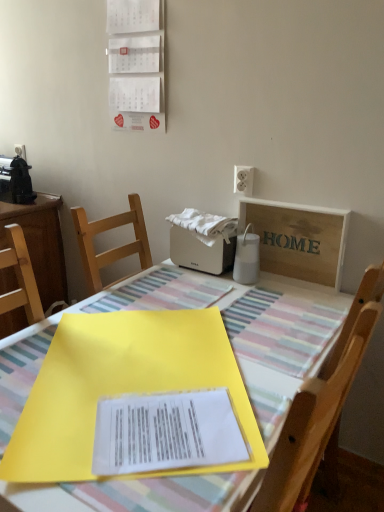
Identify the location of free space in front of white plastic toaster at center, the 2th appliance in the top-to-bottom sequence. 191,287.